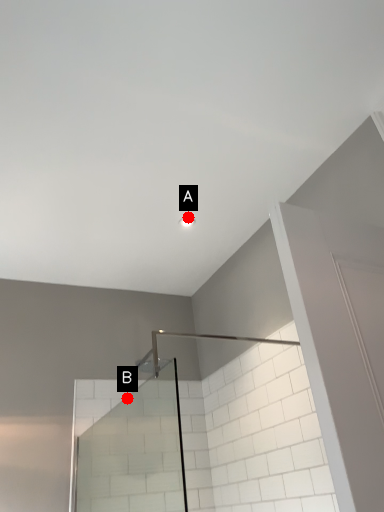
Question: Two points are circled on the image, labeled by A and B beside each circle. Which point is further to the camera?

Choices:
 (A) A is further
 (B) B is further

Answer: (B)